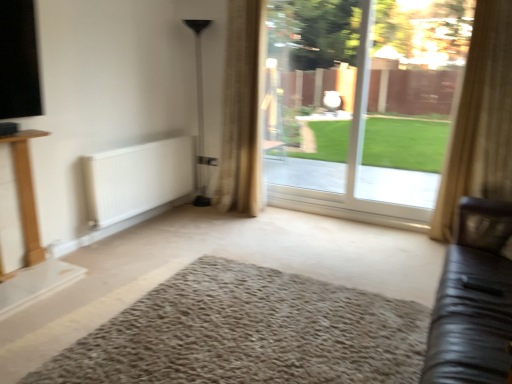
Question: From a real-world perspective, relative to beige textured curtain at center, the first curtain viewed from the left, is transparent glass door at center vertically above or below?

Choices:
 (A) below
 (B) above

Answer: (A)

Question: Considering the relative positions of transparent glass door at center and beige textured curtain at center, acting as the 2th curtain starting from the front, in the image provided, is transparent glass door at center to the left or to the right of beige textured curtain at center, acting as the 2th curtain starting from the front,?

Choices:
 (A) left
 (B) right

Answer: (B)

Question: Which object is the farthest from the beige shaggy rug at center?

Choices:
 (A) white matte radiator at lower left
 (B) metallic silver lamp at center
 (C) beige textured curtain at center, placed as the 2th curtain when sorted from right to left
 (D) beige textured curtain at right, acting as the first curtain starting from the right
 (E) black leather couch at right

Answer: (B)

Question: Which object is the closest to the transparent glass door at center?

Choices:
 (A) beige textured curtain at center, arranged as the 1th curtain when viewed from the back
 (B) beige textured curtain at right, placed as the 1th curtain when sorted from front to back
 (C) beige shaggy rug at center
 (D) white matte radiator at lower left
 (E) black leather couch at right

Answer: (A)